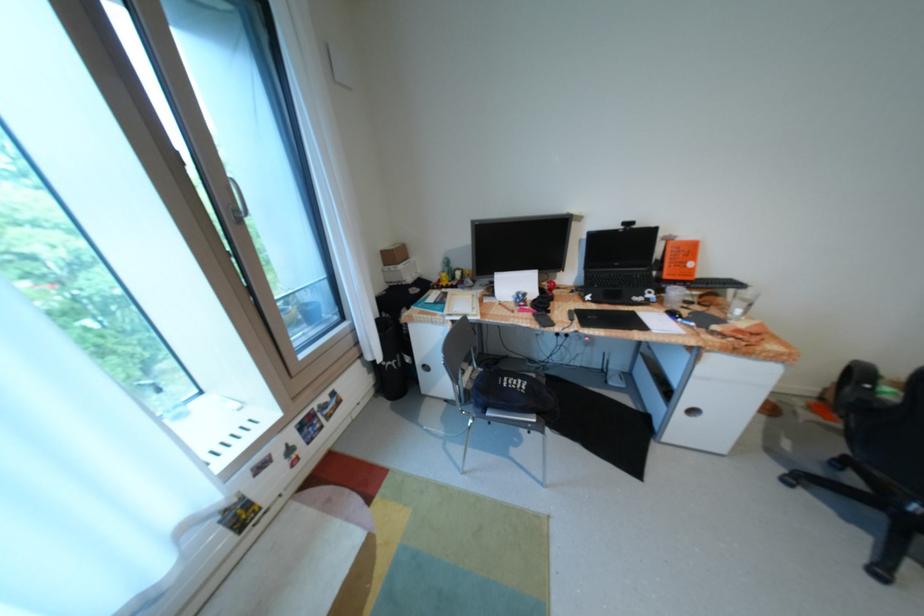
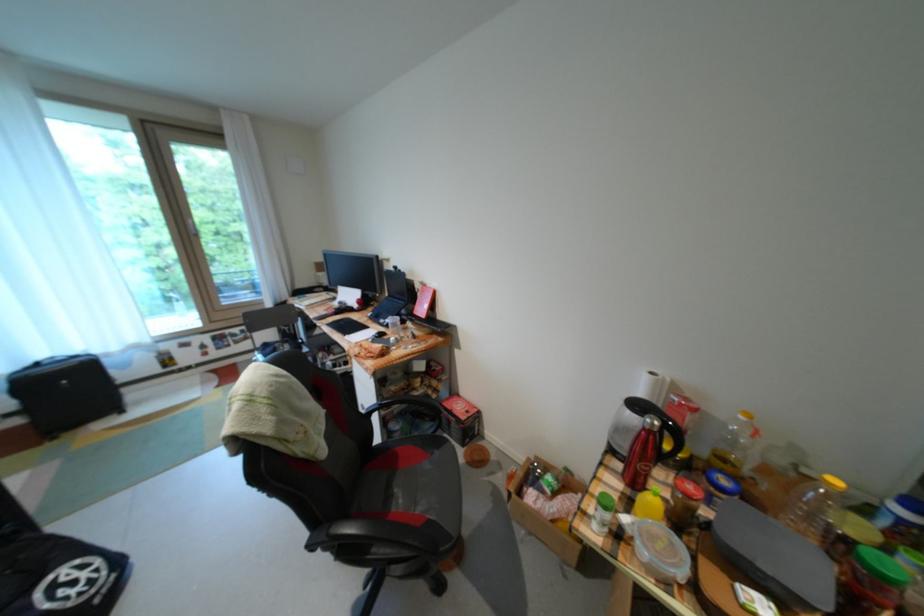
Question: What movement of the cameraman would produce the second image?

Choices:
 (A) Left
 (B) Right
 (C) Forward
 (D) Backward

Answer: (B)